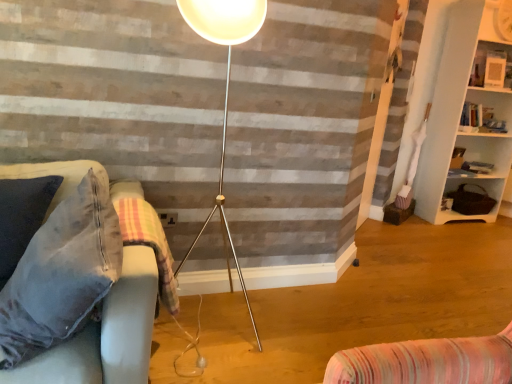
Question: From a real-world perspective, does plaid fabric blanket at lower left sit lower than white glossy picture frame at upper right, which is the 3th shelf from bottom to top?

Choices:
 (A) yes
 (B) no

Answer: (A)

Question: Is plaid fabric blanket at lower left to the left of white glossy picture frame at upper right, which is counted as the 1th shelf, starting from the top, from the viewer's perspective?

Choices:
 (A) no
 (B) yes

Answer: (B)

Question: Would you say plaid fabric blanket at lower left is a long distance from white glossy picture frame at upper right, which is the 3th shelf from bottom to top?

Choices:
 (A) no
 (B) yes

Answer: (B)

Question: Considering the relative sizes of plaid fabric blanket at lower left and white glossy picture frame at upper right, which is counted as the 1th shelf, starting from the top, in the image provided, is plaid fabric blanket at lower left wider than white glossy picture frame at upper right, which is counted as the 1th shelf, starting from the top,?

Choices:
 (A) yes
 (B) no

Answer: (A)

Question: From a real-world perspective, is plaid fabric blanket at lower left located higher than white glossy picture frame at upper right, which is the 3th shelf from bottom to top?

Choices:
 (A) yes
 (B) no

Answer: (B)

Question: Is plaid fabric blanket at lower left oriented away from white glossy picture frame at upper right, which is counted as the 1th shelf, starting from the top?

Choices:
 (A) no
 (B) yes

Answer: (A)

Question: Does white matte bookshelf at right, the 2th shelf from the top, turn towards velvet fabric couch at left?

Choices:
 (A) yes
 (B) no

Answer: (B)

Question: Does white matte bookshelf at right, the 2th shelf from the top, appear on the left side of velvet fabric couch at left?

Choices:
 (A) no
 (B) yes

Answer: (A)

Question: From the image's perspective, is white matte bookshelf at right, the 2th shelf from the top, under velvet fabric couch at left?

Choices:
 (A) yes
 (B) no

Answer: (B)

Question: Is white matte bookshelf at right, the 2th shelf from the top, not inside velvet fabric couch at left?

Choices:
 (A) yes
 (B) no

Answer: (A)

Question: Can you confirm if white matte bookshelf at right, the second shelf from the bottom, is bigger than velvet fabric couch at left?

Choices:
 (A) no
 (B) yes

Answer: (B)

Question: Can you confirm if white matte bookshelf at right, the second shelf from the bottom, is positioned to the right of velvet fabric couch at left?

Choices:
 (A) yes
 (B) no

Answer: (A)

Question: Is wooden textured basket at right, which ranks as the 3th shelf in top-to-bottom order, not near white glossy picture frame at upper right, which is the 3th shelf from bottom to top?

Choices:
 (A) no
 (B) yes

Answer: (B)